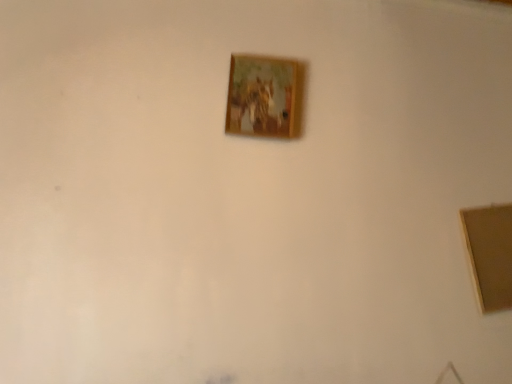
Question: Are wooden picture frame at upper center, placed as the 2th picture frame when sorted from left to right, and wooden frame at center, the 1th picture frame positioned from the left, located far from each other?

Choices:
 (A) no
 (B) yes

Answer: (A)

Question: Is wooden frame at center, the 1th picture frame positioned from the left, at the back of wooden picture frame at upper center, which appears as the 1th picture frame when viewed from the right?

Choices:
 (A) no
 (B) yes

Answer: (A)

Question: From a real-world perspective, is wooden picture frame at upper center, placed as the 2th picture frame when sorted from left to right, located beneath wooden frame at center, which is the second picture frame in right-to-left order?

Choices:
 (A) yes
 (B) no

Answer: (A)

Question: Is wooden frame at center, which is the second picture frame in right-to-left order, surrounded by wooden picture frame at upper center, which appears as the 1th picture frame when viewed from the right?

Choices:
 (A) no
 (B) yes

Answer: (A)

Question: Can you confirm if wooden picture frame at upper center, marked as the 2th picture frame in a top-to-bottom arrangement, is positioned to the right of wooden frame at center, which appears as the second picture frame when ordered from the bottom?

Choices:
 (A) yes
 (B) no

Answer: (A)

Question: From a real-world perspective, is wooden picture frame at upper center, placed as the 2th picture frame when sorted from left to right, located higher than wooden frame at center, which appears as the second picture frame when ordered from the bottom?

Choices:
 (A) yes
 (B) no

Answer: (B)

Question: From a real-world perspective, does wooden frame at center, the 1th picture frame positioned from the left, sit lower than wooden picture frame at upper center, marked as the 2th picture frame in a top-to-bottom arrangement?

Choices:
 (A) yes
 (B) no

Answer: (B)

Question: Is wooden picture frame at upper center, marked as the 2th picture frame in a top-to-bottom arrangement, completely or partially inside wooden frame at center, the 1th picture frame positioned from the left?

Choices:
 (A) no
 (B) yes

Answer: (A)

Question: From the image's perspective, does wooden frame at center, the first picture frame viewed from the top, appear higher than wooden picture frame at upper center, marked as the 2th picture frame in a top-to-bottom arrangement?

Choices:
 (A) no
 (B) yes

Answer: (B)

Question: Is the depth of wooden frame at center, the 1th picture frame positioned from the left, greater than that of wooden picture frame at upper center, placed as the 2th picture frame when sorted from left to right?

Choices:
 (A) no
 (B) yes

Answer: (B)

Question: Considering the relative sizes of wooden frame at center, which appears as the second picture frame when ordered from the bottom, and wooden picture frame at upper center, the first picture frame ordered from the bottom, in the image provided, is wooden frame at center, which appears as the second picture frame when ordered from the bottom, smaller than wooden picture frame at upper center, the first picture frame ordered from the bottom,?

Choices:
 (A) no
 (B) yes

Answer: (B)

Question: Is wooden frame at center, which is the second picture frame in right-to-left order, to the left of wooden picture frame at upper center, the first picture frame ordered from the bottom, from the viewer's perspective?

Choices:
 (A) no
 (B) yes

Answer: (B)

Question: Considering the positions of wooden frame at center, the 1th picture frame positioned from the left, and wooden picture frame at upper center, placed as the 2th picture frame when sorted from left to right, in the image, is wooden frame at center, the 1th picture frame positioned from the left, taller or shorter than wooden picture frame at upper center, placed as the 2th picture frame when sorted from left to right,?

Choices:
 (A) short
 (B) tall

Answer: (A)